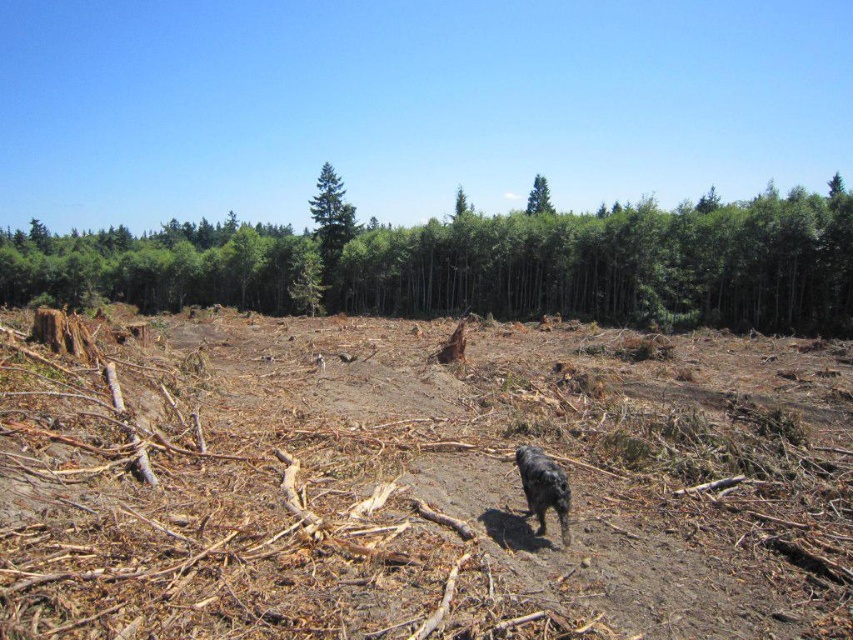
Who is more distant from viewer, (538, 259) or (537, 451)?

Positioned behind is point (538, 259).

Does green textured tree at center have a lesser width compared to black furry dog at center?

In fact, green textured tree at center might be wider than black furry dog at center.

Who is more forward, (434,220) or (544,506)?

Point (544,506) is more forward.

Locate an element on the screen. The image size is (853, 640). green textured tree at center is located at coordinates 614,264.

Which is below, green textured tree at center or green smooth tree at center?

green smooth tree at center is lower down.

Is green textured tree at center positioned in front of green smooth tree at center?

Yes.

Image resolution: width=853 pixels, height=640 pixels. Find the location of `green textured tree at center`. green textured tree at center is located at coordinates (614, 264).

Between point (378, 609) and point (538, 532), which one is positioned behind?

Positioned behind is point (538, 532).

Locate an element on the screen. brown dirt field at center is located at coordinates (419, 486).

This screenshot has height=640, width=853. I want to click on brown dirt field at center, so click(x=419, y=486).